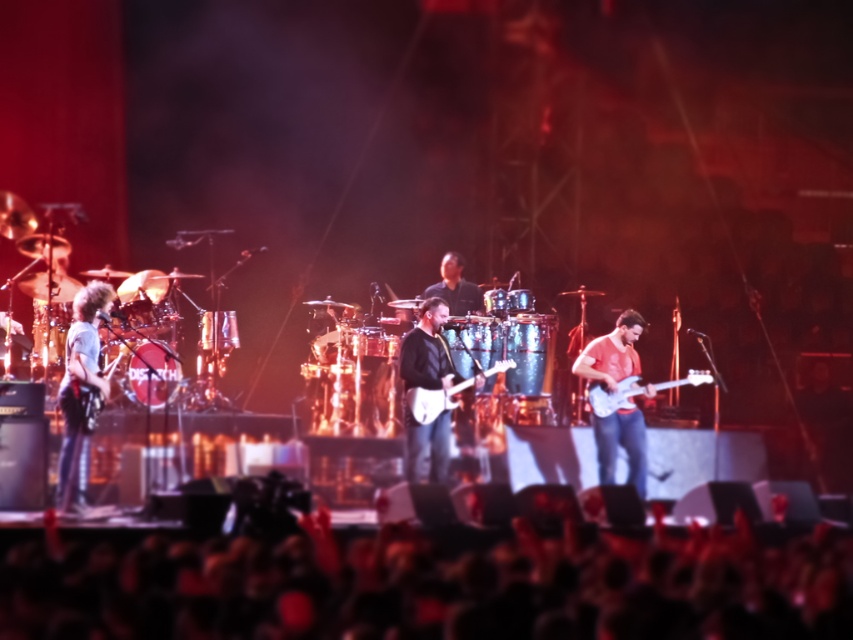
You are at the concert and want to take a photo of the drummer and the guitarist. The drummer is at point [590,596] and the guitarist is at point [413,460]. Which point is closer to you to ensure a clear shot?

Point [590,596] is closer to the camera than point [413,460], so you should focus on that point for a clearer shot.

You are a photographer at the concert and want to capture the black fabric at lower center. Where exactly should you aim your camera to get the best shot?

You should aim your camera at point (430, 582) to capture the black fabric at lower center.

You are a stagehand who needs to move a 6.5 feet long ladder from the black fabric at lower center to the white glossy electric guitar at right. Can you safely move the ladder without it hitting anything in between?

The distance between the black fabric at lower center and the white glossy electric guitar at right is 7.55 feet, which is longer than the ladder length of 6.5 feet. Therefore, you can safely move the ladder between them without it hitting anything.